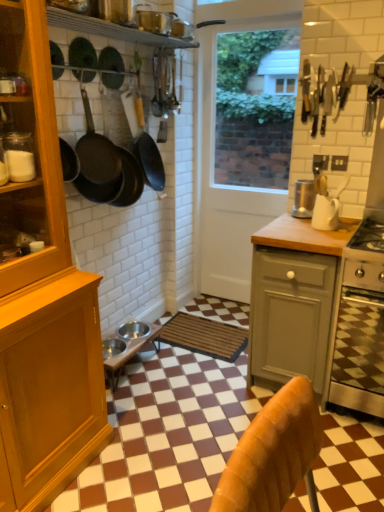
Question: Is there a large distance between white glossy door at center and black matte frying pan at upper left, arranged as the 1th frying pan when viewed from the front?

Choices:
 (A) yes
 (B) no

Answer: (A)

Question: Can you confirm if white glossy door at center is taller than black matte frying pan at upper left, arranged as the 3th frying pan when viewed from the back?

Choices:
 (A) no
 (B) yes

Answer: (B)

Question: Is white glossy door at center not within black matte frying pan at upper left, arranged as the 1th frying pan when viewed from the front?

Choices:
 (A) no
 (B) yes

Answer: (B)

Question: Is white glossy door at center wider than black matte frying pan at upper left, arranged as the 3th frying pan when viewed from the back?

Choices:
 (A) no
 (B) yes

Answer: (A)

Question: Is white glossy door at center surrounding black matte frying pan at upper left, arranged as the 1th frying pan when viewed from the front?

Choices:
 (A) no
 (B) yes

Answer: (A)

Question: Considering the positions of white matte mug at upper right, the 2th kitchen appliance positioned from the back, and wooden cabinet at left in the image, is white matte mug at upper right, the 2th kitchen appliance positioned from the back, taller or shorter than wooden cabinet at left?

Choices:
 (A) short
 (B) tall

Answer: (A)

Question: Is white matte mug at upper right, positioned as the first kitchen appliance in front-to-back order, inside or outside of wooden cabinet at left?

Choices:
 (A) outside
 (B) inside

Answer: (A)

Question: Looking at their shapes, would you say white matte mug at upper right, positioned as the first kitchen appliance in front-to-back order, is wider or thinner than wooden cabinet at left?

Choices:
 (A) thin
 (B) wide

Answer: (A)

Question: Is white matte mug at upper right, the 2th kitchen appliance positioned from the back, bigger or smaller than wooden cabinet at left?

Choices:
 (A) big
 (B) small

Answer: (B)

Question: Is wooden at right spatially inside white glossy door at center, or outside of it?

Choices:
 (A) inside
 (B) outside

Answer: (B)

Question: From the image's perspective, relative to white glossy door at center, is wooden at right above or below?

Choices:
 (A) below
 (B) above

Answer: (A)

Question: Is wooden at right bigger or smaller than white glossy door at center?

Choices:
 (A) small
 (B) big

Answer: (B)

Question: Is wooden at right in front of or behind white glossy door at center in the image?

Choices:
 (A) front
 (B) behind

Answer: (A)

Question: Is black matte frying pan at upper center, which ranks as the first frying pan in back-to-front order, bigger or smaller than wooden cabinet at left?

Choices:
 (A) big
 (B) small

Answer: (B)

Question: In the image, is black matte frying pan at upper center, which ranks as the first frying pan in back-to-front order, on the left side or the right side of wooden cabinet at left?

Choices:
 (A) left
 (B) right

Answer: (B)